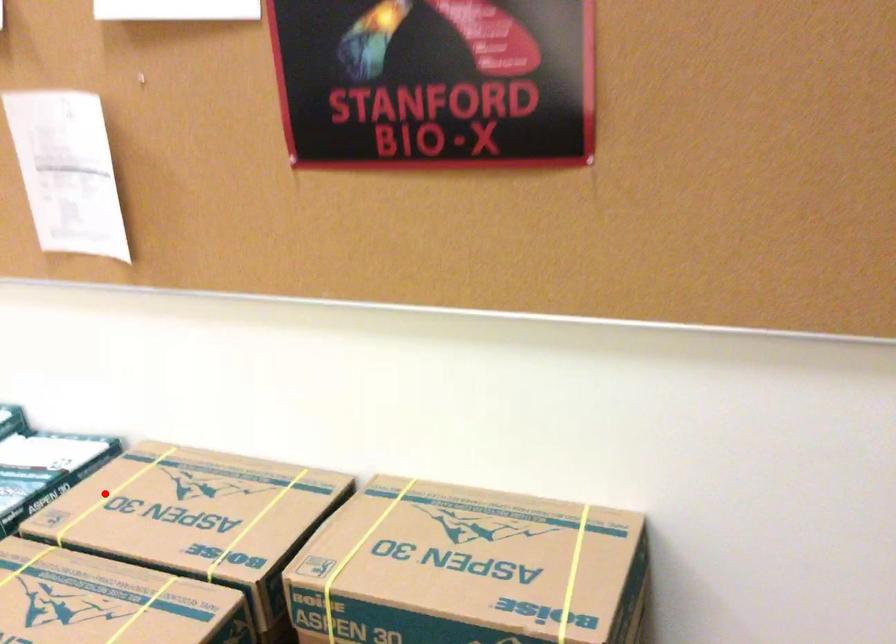
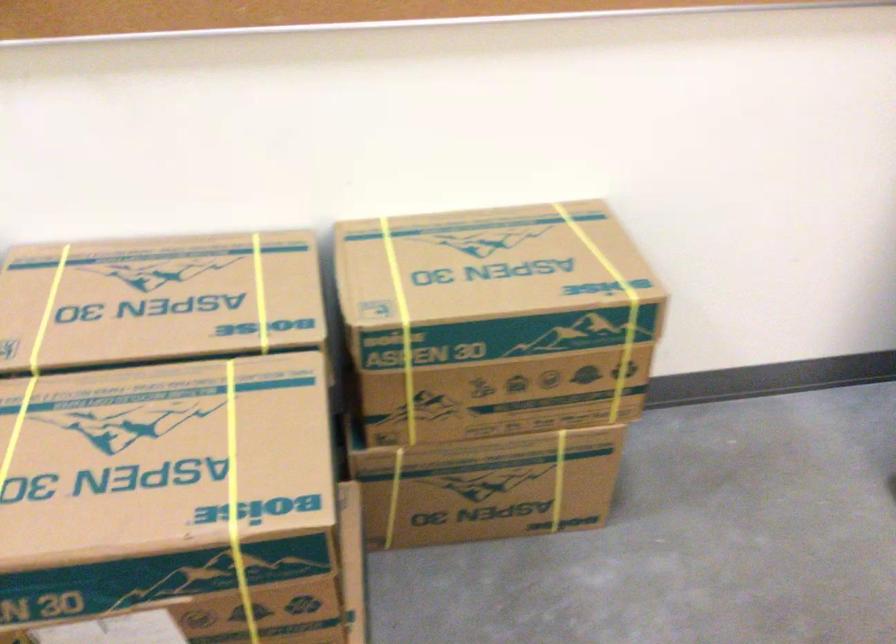
Question: I am providing you with two images of the same scene from different viewpoints. A red point is shown in image1. For the corresponding object point in image2, is it positioned nearer or farther from the camera?

Choices:
 (A) Nearer
 (B) Farther

Answer: (A)